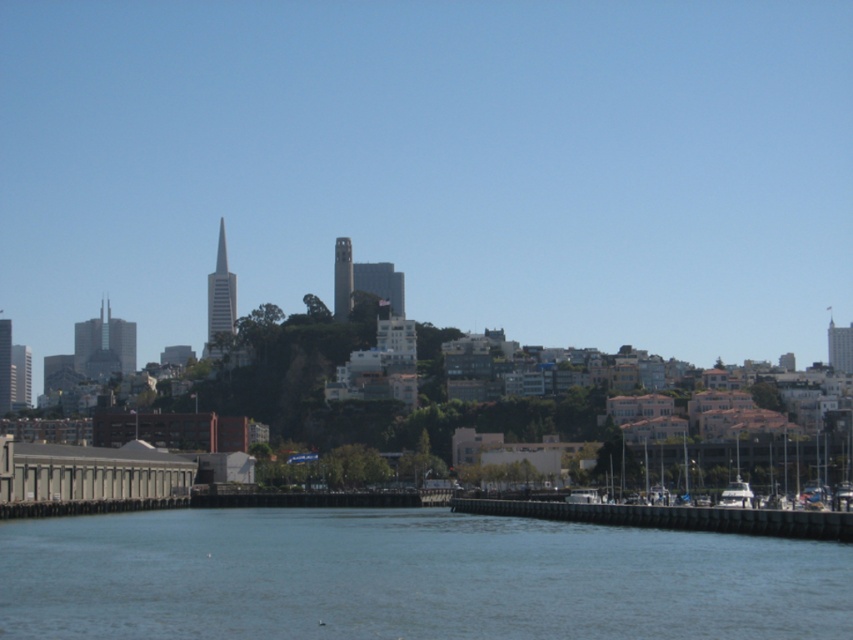
Based on the photo, which of these two, blue water at center or brown wooden dock at lower center, stands taller?

blue water at center is taller.

Is blue water at center bigger than brown wooden dock at lower center?

Yes, blue water at center is bigger than brown wooden dock at lower center.

Image resolution: width=853 pixels, height=640 pixels. What do you see at coordinates (407, 577) in the screenshot?
I see `blue water at center` at bounding box center [407, 577].

Find the location of `blue water at center`. blue water at center is located at coordinates (407, 577).